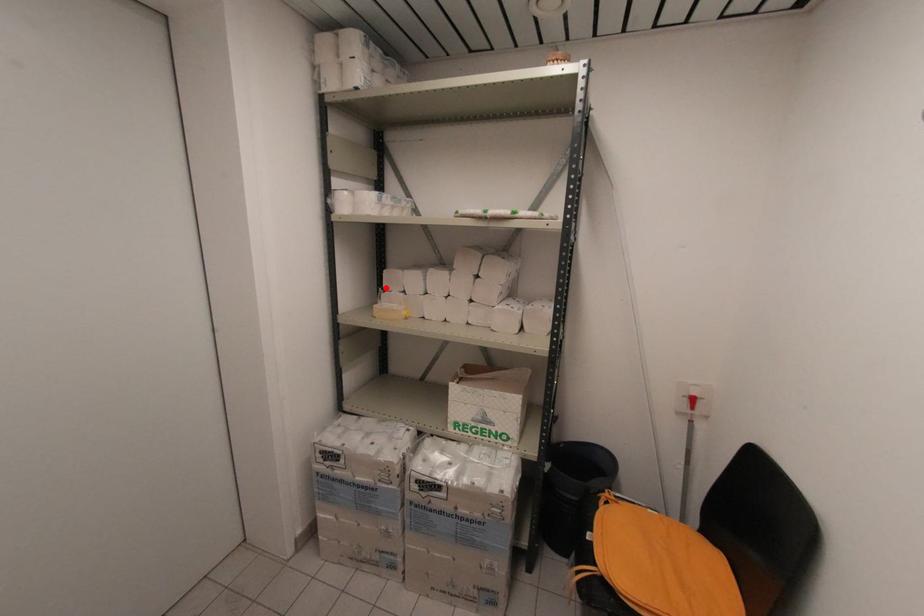
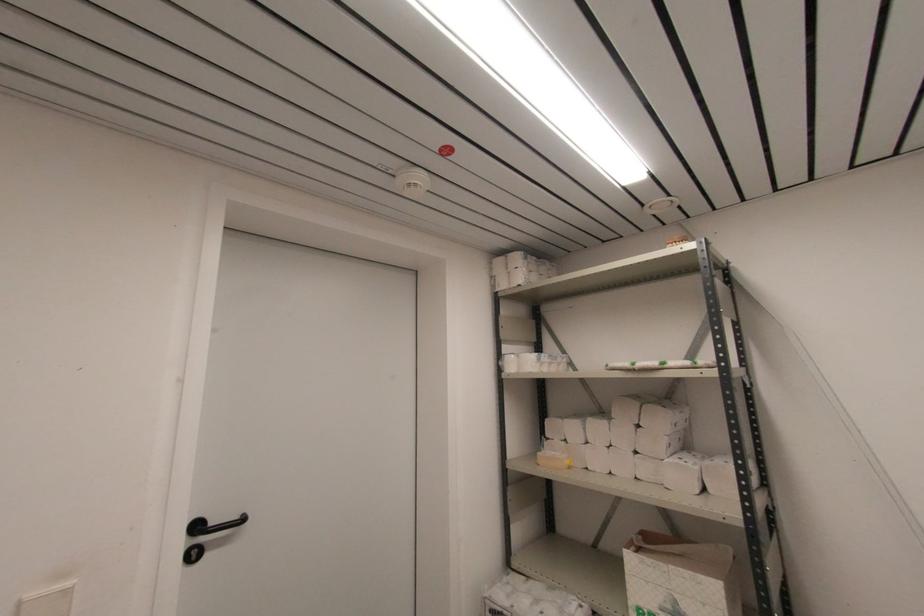
Where in the second image is the point corresponding to the highlighted location from the first image?

(548, 436)